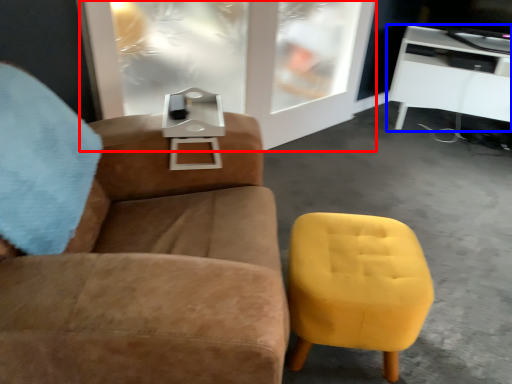
Question: Which object appears farthest to the camera in this image, glass door (highlighted by a red box) or table (highlighted by a blue box)?

Choices:
 (A) glass door
 (B) table

Answer: (B)